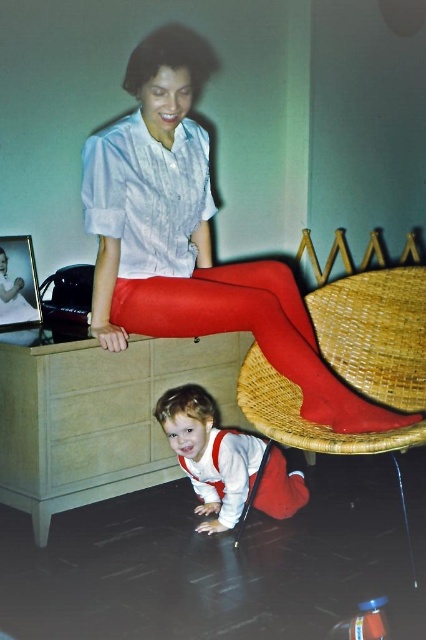
Question: Based on their relative distances, which object is nearer to the woven wood chair at lower center?

Choices:
 (A) matte red skirt at upper center
 (B) matte red tights at lower center
 (C) white cotton onesie at lower center

Answer: (B)

Question: Which object is the closest to the matte red skirt at upper center?

Choices:
 (A) matte red tights at lower center
 (B) white cotton onesie at lower center
 (C) woven wood chair at lower center

Answer: (A)

Question: Is matte red skirt at upper center positioned at the back of white cotton onesie at lower center?

Choices:
 (A) no
 (B) yes

Answer: (A)

Question: Does woven wood chair at lower center have a larger size compared to white cotton onesie at lower center?

Choices:
 (A) yes
 (B) no

Answer: (B)

Question: Can you confirm if matte red skirt at upper center is positioned to the left of matte red tights at lower center?

Choices:
 (A) yes
 (B) no

Answer: (A)

Question: Which of the following is the closest to the observer?

Choices:
 (A) matte red skirt at upper center
 (B) woven wood chair at lower center

Answer: (A)